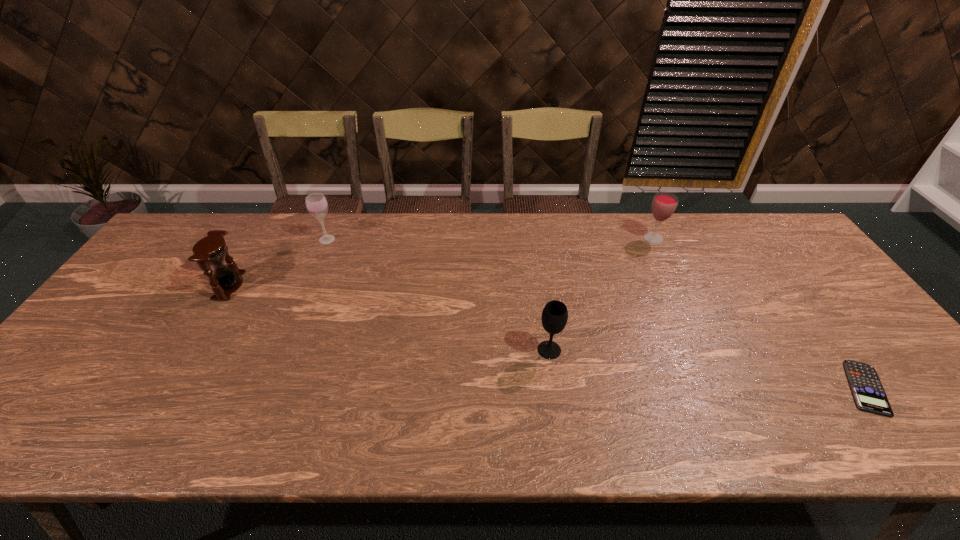
Image resolution: width=960 pixels, height=540 pixels. What are the coordinates of `the second object from left to right` in the screenshot? It's located at (316, 203).

You are a GUI agent. You are given a task and a screenshot of the screen. Output one action in this format:
    pyautogui.click(x=<x>, y=<y>)
    Task: Click on the rightmost wineglass
    
    Given the screenshot: What is the action you would take?
    pyautogui.click(x=664, y=204)

Where is `hourglass`? The height and width of the screenshot is (540, 960). hourglass is located at coordinates (211, 250).

This screenshot has width=960, height=540. Find the location of `the leftmost object`. the leftmost object is located at coordinates (211, 250).

Locate an element on the screen. the second nearest object is located at coordinates (554, 317).

The width and height of the screenshot is (960, 540). In order to click on the second wineglass from left to right in this screenshot , I will do `click(554, 317)`.

At what (x,y) coordinates should I click in order to perform the action: click on the nearest object. Please return your answer as a coordinate pair (x, y). The height and width of the screenshot is (540, 960). Looking at the image, I should click on (869, 394).

Find the location of `calculator`. calculator is located at coordinates (869, 394).

Locate an element on the screen. This screenshot has height=540, width=960. vacant space located 0.100m on the back of the leftmost wineglass is located at coordinates (337, 216).

Locate an element on the screen. Image resolution: width=960 pixels, height=540 pixels. vacant space located 0.290m on the front of the fourth object from left to right is located at coordinates (688, 313).